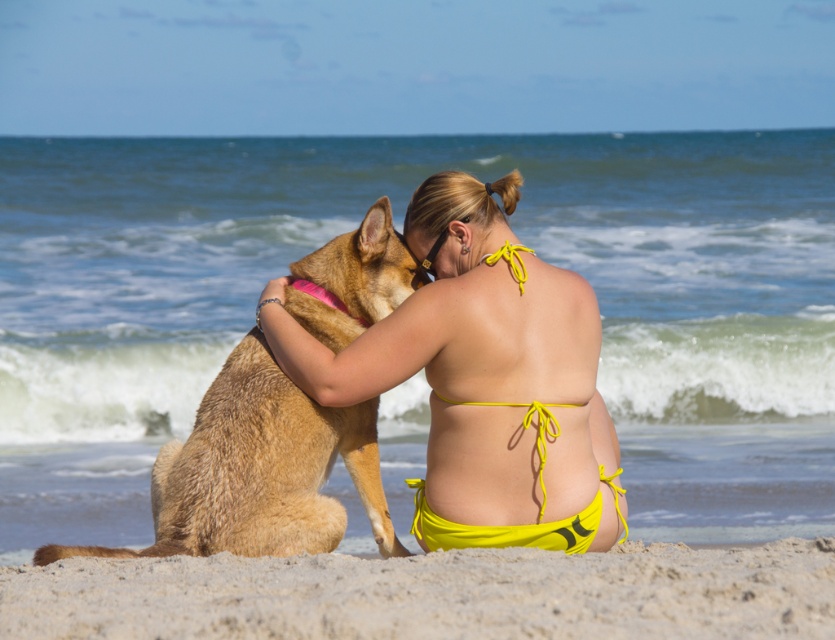
Does fine-grained sand at lower center lie in front of golden fur dog at center?

Yes.

Is fine-grained sand at lower center taller than golden fur dog at center?

In fact, fine-grained sand at lower center may be shorter than golden fur dog at center.

Between point (491, 598) and point (407, 292), which one is positioned in front?

Point (491, 598)

This screenshot has width=835, height=640. I want to click on fine-grained sand at lower center, so click(x=434, y=595).

Does golden fur dog at center have a lesser height compared to yellow fabric bikini at center?

Incorrect, golden fur dog at center's height does not fall short of yellow fabric bikini at center's.

Does golden fur dog at center appear under yellow fabric bikini at center?

No, golden fur dog at center is not below yellow fabric bikini at center.

Between point (188, 506) and point (616, 516), which one is positioned behind?

Point (616, 516)

You are a GUI agent. You are given a task and a screenshot of the screen. Output one action in this format:
    pyautogui.click(x=<x>, y=<y>)
    Task: Click on the golden fur dog at center
    
    Given the screenshot: What is the action you would take?
    tap(257, 470)

Can you confirm if yellow bikini at center is bigger than fine-grained sand at lower center?

Yes.

Image resolution: width=835 pixels, height=640 pixels. I want to click on yellow bikini at center, so click(x=482, y=378).

At what (x,y) coordinates should I click in order to perform the action: click on yellow bikini at center. Please return your answer as a coordinate pair (x, y). The width and height of the screenshot is (835, 640). Looking at the image, I should click on (482, 378).